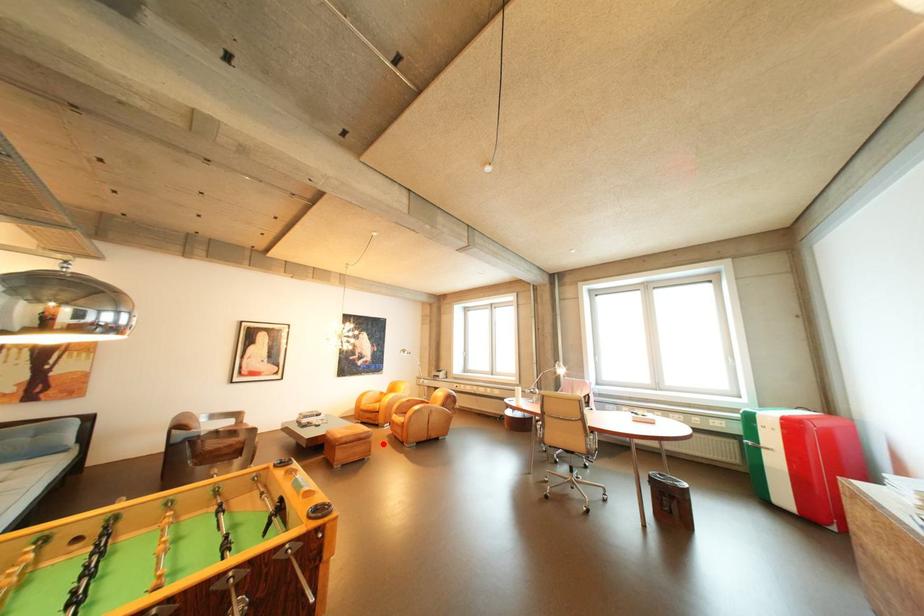
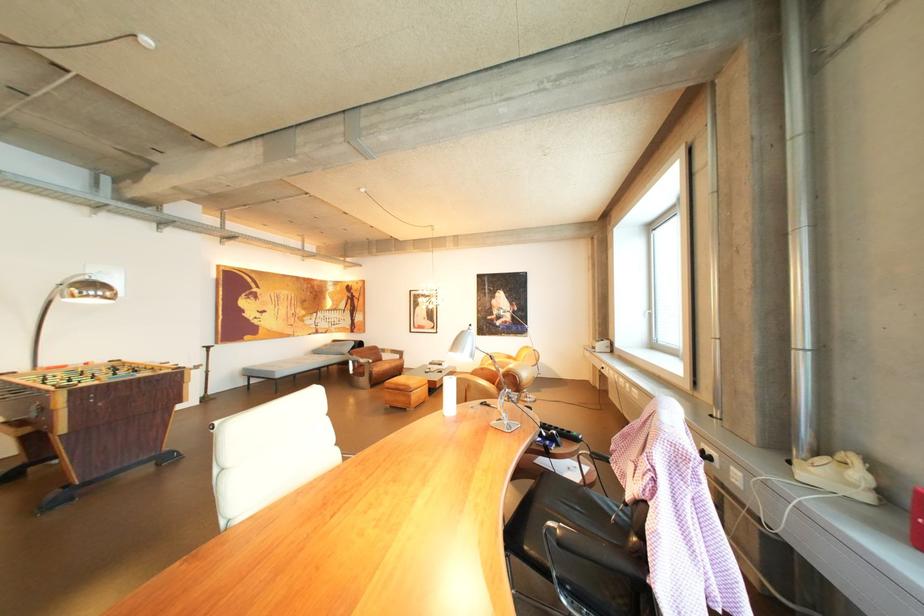
Locate, in the second image, the point that corresponds to the highlighted location in the first image.

(422, 398)